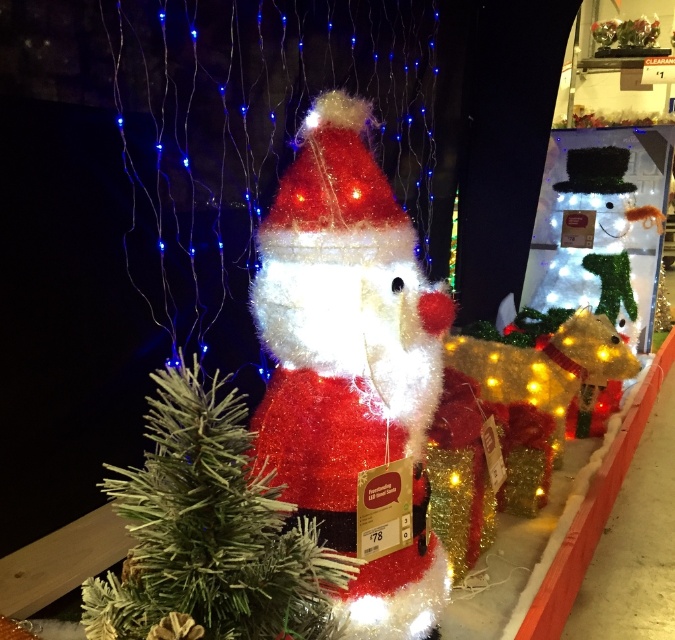
You are a customer in a store looking at the festive Christmas display. You see the fuzzy tinsel santa at center and the frosted tinsel santa at center. Which one is placed higher up?

The fuzzy tinsel santa at center is positioned over the frosted tinsel santa at center, so it is placed higher up.

You are a delivery person who needs to transport both the fuzzy tinsel santa at center and the frosted tinsel santa at center in a box that is 12 inches wide. Will both fit side by side in the box?

The distance between the fuzzy tinsel santa at center and the frosted tinsel santa at center is 11.01 inches, so they can fit side by side in the 12 inch wide box since the combined width is less than the box width.